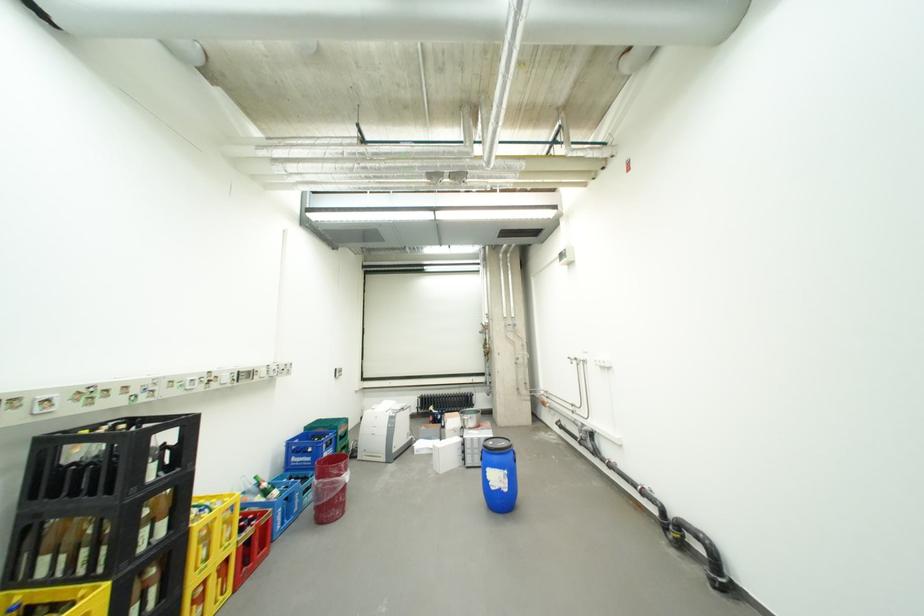
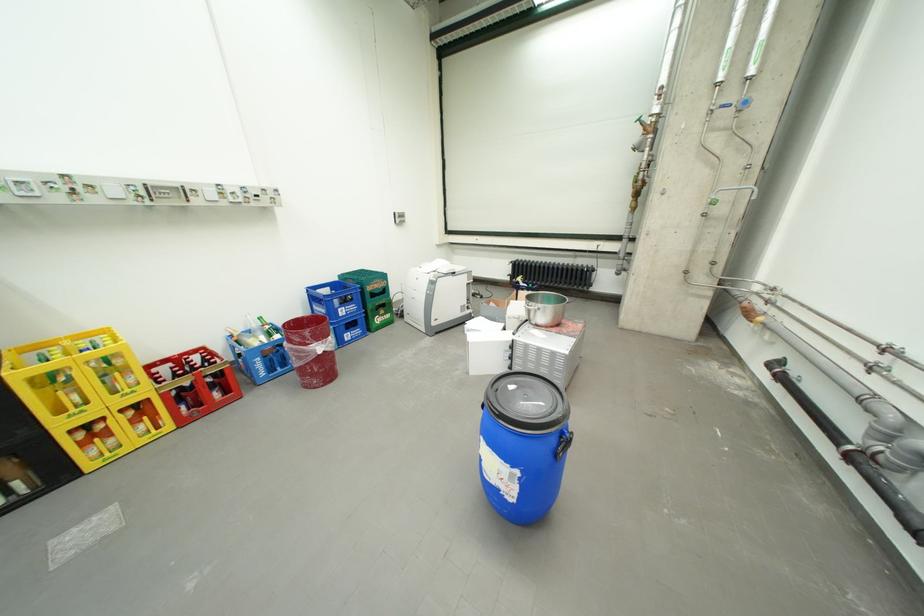
Where in the second image is the point corresponding to point (209, 525) from the first image?

(30, 374)